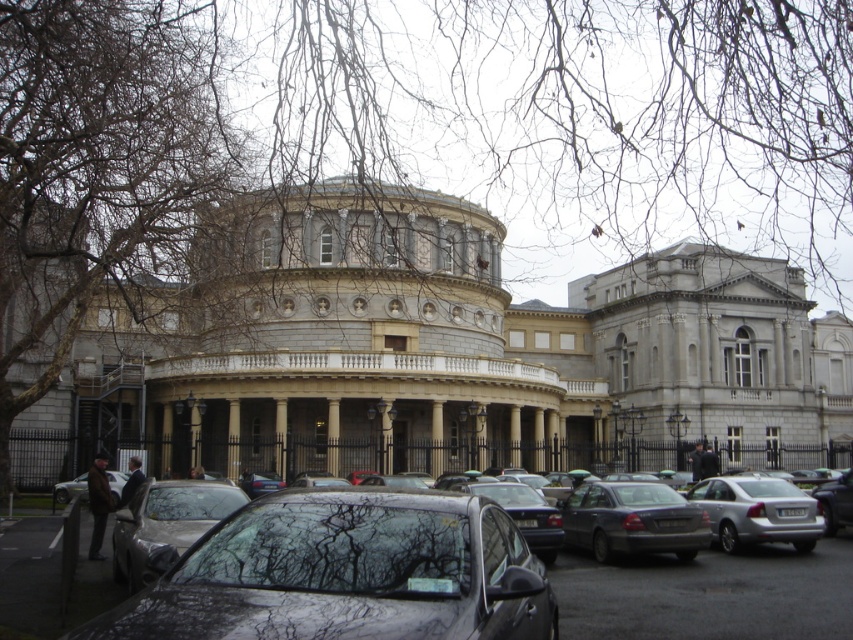
You are standing at the point marked as point (834, 428) in the image. The building you are facing is 120.92 meters away from you. If you want to take a photo of the entire building, which direction should you move to ensure the entire structure fits in your camera frame?

You should move backward because the building is 120.92 meters away from you at point (834, 428). Moving backward will increase the distance, allowing the entire structure to fit into the camera frame.

You are a delivery driver who needs to park your matte gray sedan at center in a spot that requires precise positioning. The parking spot is marked at coordinates point 0.814, 0.742. Can you confirm if your vehicle is correctly positioned?

The matte gray sedan at center is positioned exactly at point [631,520], so it is correctly parked in the designated spot.

You are standing in front of the classical building and want to determine the relative positions of two points marked in the image. Which point is closer to you, the point at coordinate point [802,500] or the point at coordinate point [78,490]?

The point at coordinate point [802,500] is closer to the viewer than the point at coordinate point [78,490].